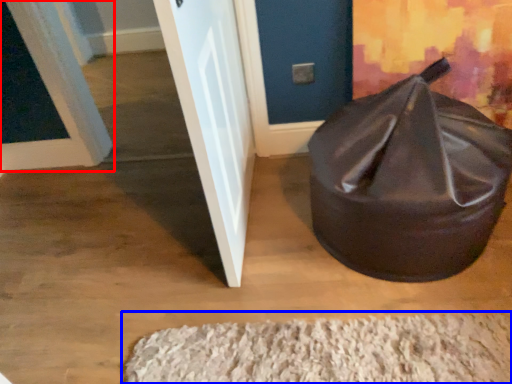
Question: Which object is further to the camera taking this photo, door (highlighted by a red box) or doormat (highlighted by a blue box)?

Choices:
 (A) door
 (B) doormat

Answer: (A)